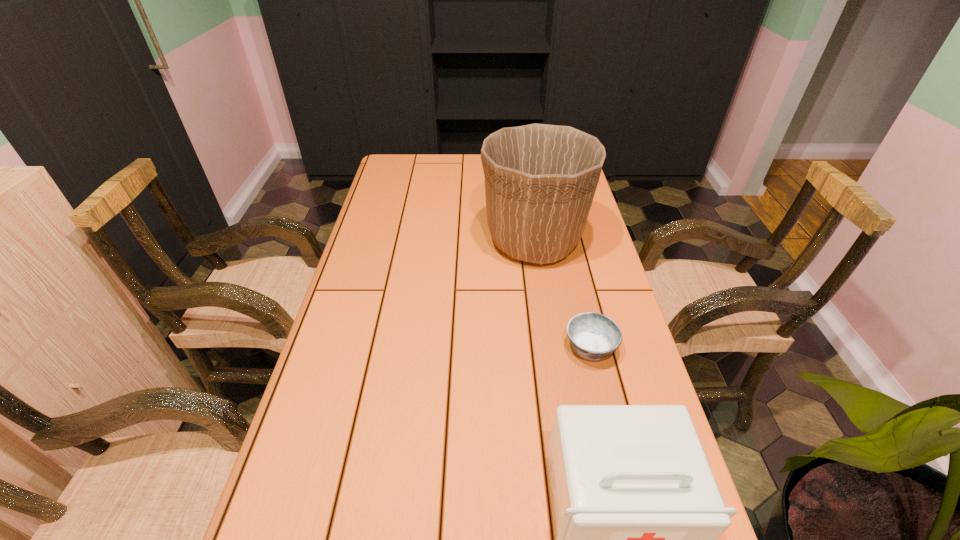
Where is `free spot at the right edge of the desktop`? free spot at the right edge of the desktop is located at coordinates (576, 277).

This screenshot has width=960, height=540. In the image, there is a desktop. In order to click on free region at the far left corner in this screenshot , I will do `click(392, 164)`.

The image size is (960, 540). I want to click on blank region between the ashtray and the farthest object, so click(563, 294).

At what (x,y) coordinates should I click in order to perform the action: click on vacant area that lies between the second nearest object and the flowerpot. Please return your answer as a coordinate pair (x, y). Looking at the image, I should click on (563, 294).

At what (x,y) coordinates should I click in order to perform the action: click on blank region between the farthest object and the ashtray. Please return your answer as a coordinate pair (x, y). Looking at the image, I should click on (563, 294).

Locate an element on the screen. The height and width of the screenshot is (540, 960). free space between the shortest object and the flowerpot is located at coordinates (563, 294).

Choose which object is the second nearest neighbor to the flowerpot. Please provide its 2D coordinates. Your answer should be formatted as a tuple, i.e. [(x, y)], where the tuple contains the x and y coordinates of a point satisfying the conditions above.

[(638, 512)]

In order to click on object that is the second nearest to the ashtray in this screenshot , I will do `click(638, 512)`.

The image size is (960, 540). What are the coordinates of `vacant space that satisfies the following two spatial constraints: 1. on the front side of the shortest object; 2. on the left side of the flowerpot` in the screenshot? It's located at (550, 347).

Where is `vacant area that satisfies the following two spatial constraints: 1. on the front side of the second nearest object; 2. on the right side of the flowerpot`? The height and width of the screenshot is (540, 960). vacant area that satisfies the following two spatial constraints: 1. on the front side of the second nearest object; 2. on the right side of the flowerpot is located at coordinates (550, 347).